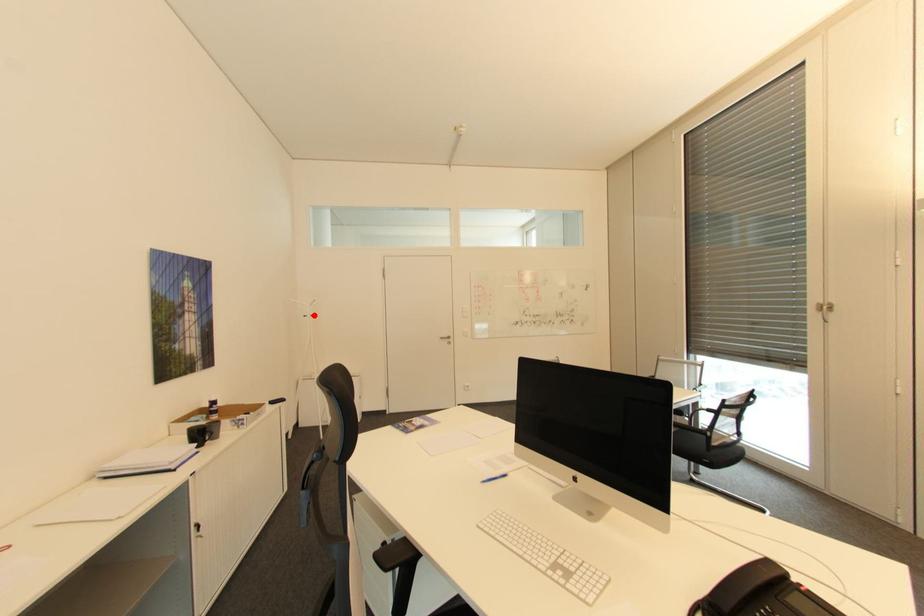
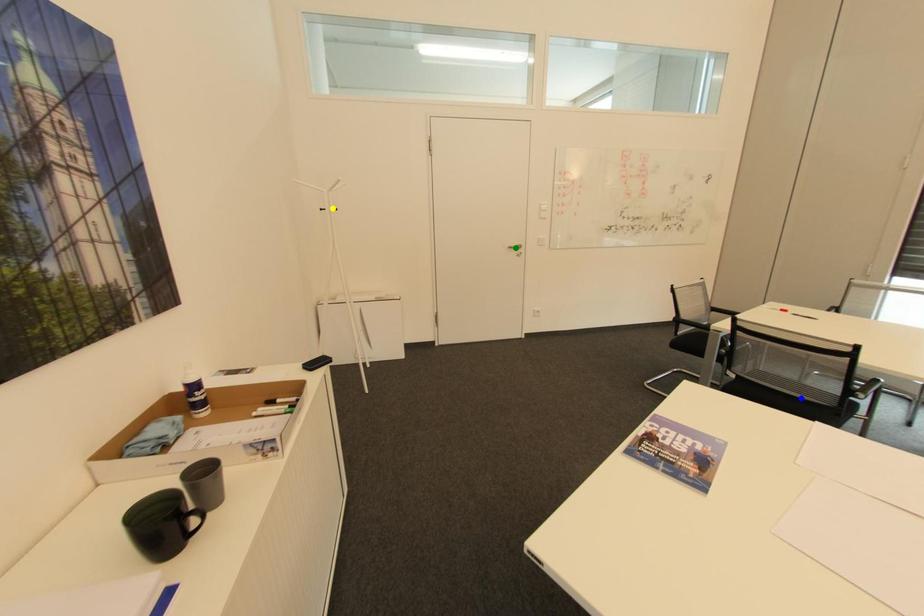
Question: I am providing you with two images of the same scene from different viewpoints. A red point is marked on the first image. You are given multiple points on the second image. Which mark in image 2 goes with the point in image 1?

Choices:
 (A) green point
 (B) blue point
 (C) yellow point

Answer: (C)